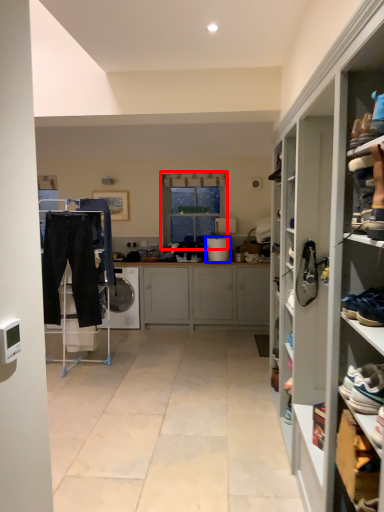
Question: Which object appears farthest to the camera in this image, window (highlighted by a red box) or appliance (highlighted by a blue box)?

Choices:
 (A) window
 (B) appliance

Answer: (A)